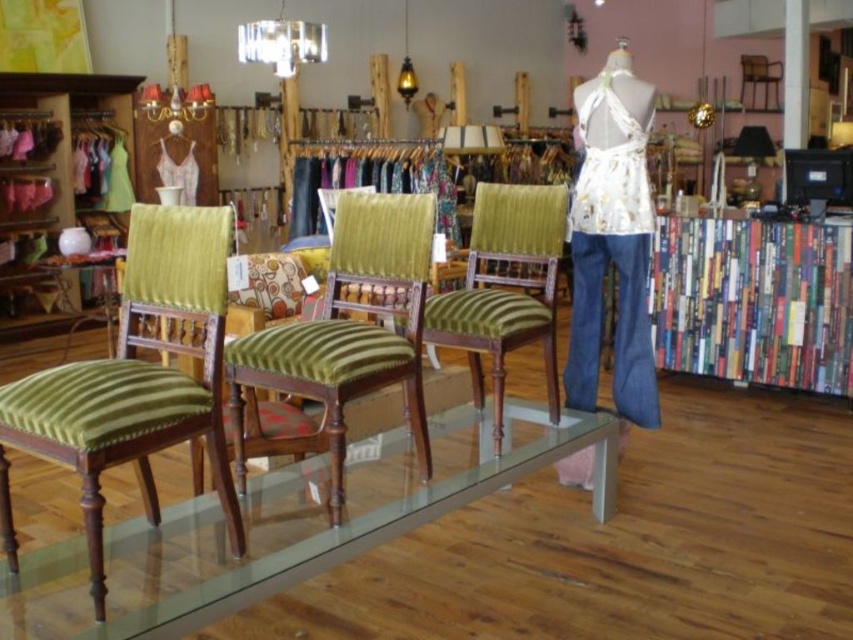
You are a customer in the store and want to sit on the green striped fabric chair at center. Can you sit there without moving the transparent glass table at center?

The transparent glass table at center is positioned under the green striped fabric chair at center, so you can sit on the green striped fabric chair at center without needing to move the transparent glass table at center.

You are a customer in the store and want to sit on the green velvet chair at center. However, there is a white floral fabric at center on the chair. Can you sit on the chair without moving the fabric?

The green velvet chair at center might be wider than the white floral fabric at center, so there might be space to sit on the chair without moving the fabric.

You are standing in the retail store and want to find the multicolored wood bookshelf at right. Based on the coordinates provided, where should you look relative to the chairs?

The multicolored wood bookshelf at right is located at coordinates point (753, 301), which means it is positioned to the right side of the chairs.